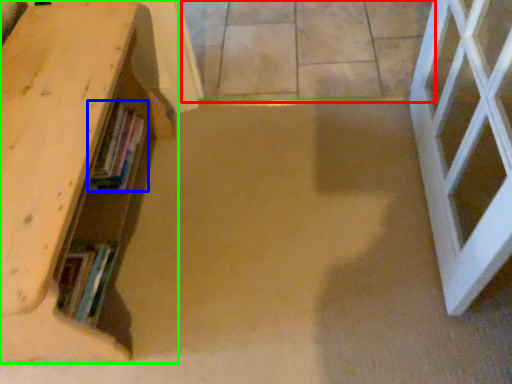
Question: Which is farther away from concrete (highlighted by a red box)? book (highlighted by a blue box) or shelf (highlighted by a green box)?

Choices:
 (A) book
 (B) shelf

Answer: (A)